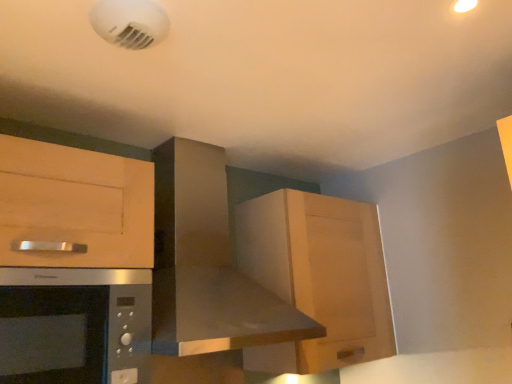
You are a GUI agent. You are given a task and a screenshot of the screen. Output one action in this format:
    pyautogui.click(x=<x>, y=<y>)
    Task: Click on the stainless steel range hood at center
    
    Given the screenshot: What is the action you would take?
    pyautogui.click(x=206, y=264)

Which object is positioned more to the left, satin silver microwave at lower left or stainless steel range hood at center?

satin silver microwave at lower left is more to the left.

Based on their sizes in the image, would you say satin silver microwave at lower left is bigger or smaller than stainless steel range hood at center?

satin silver microwave at lower left is smaller than stainless steel range hood at center.

Is satin silver microwave at lower left taller or shorter than stainless steel range hood at center?

Clearly, satin silver microwave at lower left is shorter compared to stainless steel range hood at center.

Would you consider satin silver microwave at lower left to be distant from wooden cabinet at upper right?

No, satin silver microwave at lower left is not far from wooden cabinet at upper right.

In the scene shown: From a real-world perspective, who is located higher, satin silver microwave at lower left or wooden cabinet at upper right?

In real-world perspective, wooden cabinet at upper right is above.

Which object is further away from the camera taking this photo, satin silver microwave at lower left or wooden cabinet at upper right?

wooden cabinet at upper right is more distant.

Is stainless steel range hood at center spatially inside wooden cabinet at upper right, or outside of it?

stainless steel range hood at center lies outside wooden cabinet at upper right.

Does stainless steel range hood at center turn towards wooden cabinet at upper right?

No, stainless steel range hood at center is not turned towards wooden cabinet at upper right.

Considering the relative sizes of stainless steel range hood at center and wooden cabinet at upper right in the image provided, is stainless steel range hood at center smaller than wooden cabinet at upper right?

No, stainless steel range hood at center is not smaller than wooden cabinet at upper right.

Is wooden cabinet at upper right in front of or behind stainless steel range hood at center in the image?

wooden cabinet at upper right is behind stainless steel range hood at center.

Is wooden cabinet at upper right inside the boundaries of stainless steel range hood at center, or outside?

wooden cabinet at upper right cannot be found inside stainless steel range hood at center.

Consider the image. From a real-world perspective, which is physically above, wooden cabinet at upper right or stainless steel range hood at center?

stainless steel range hood at center.

Looking at this image, which of these two, wooden cabinet at upper right or stainless steel range hood at center, is smaller?

wooden cabinet at upper right is smaller.

Would you say stainless steel range hood at center contains satin silver microwave at lower left?

No.

From the image's perspective, which is below, stainless steel range hood at center or satin silver microwave at lower left?

satin silver microwave at lower left.

Is stainless steel range hood at center aimed at satin silver microwave at lower left?

No, stainless steel range hood at center does not turn towards satin silver microwave at lower left.

From a real-world perspective, between wooden cabinet at upper right and satin silver microwave at lower left, who is vertically lower?

satin silver microwave at lower left is physically lower.

Which of these two, wooden cabinet at upper right or satin silver microwave at lower left, is thinner?

Thinner between the two is satin silver microwave at lower left.

Relative to satin silver microwave at lower left, is wooden cabinet at upper right in front or behind?

In the image, wooden cabinet at upper right appears behind satin silver microwave at lower left.

The width and height of the screenshot is (512, 384). In the image, there is a stainless steel range hood at center. In order to click on microwave oven below it (from a real-world perspective) in this screenshot , I will do `click(74, 325)`.

At what (x,y) coordinates should I click in order to perform the action: click on cabinetry above the satin silver microwave at lower left (from a real-world perspective). Please return your answer as a coordinate pair (x, y). This screenshot has height=384, width=512. Looking at the image, I should click on (318, 277).

Considering their positions, is wooden cabinet at upper right positioned closer to satin silver microwave at lower left than stainless steel range hood at center?

stainless steel range hood at center is closer to satin silver microwave at lower left.

Based on their spatial positions, is wooden cabinet at upper right or satin silver microwave at lower left closer to stainless steel range hood at center?

wooden cabinet at upper right is positioned closer to the anchor stainless steel range hood at center.

Looking at the image, which one is located closer to wooden cabinet at upper right, stainless steel range hood at center or satin silver microwave at lower left?

Based on the image, stainless steel range hood at center appears to be nearer to wooden cabinet at upper right.

Estimate the real-world distances between objects in this image. Which object is closer to satin silver microwave at lower left, stainless steel range hood at center or wooden cabinet at upper right?

Among the two, stainless steel range hood at center is located nearer to satin silver microwave at lower left.

When comparing their distances from stainless steel range hood at center, does satin silver microwave at lower left or wooden cabinet at upper right seem closer?

The object closer to stainless steel range hood at center is wooden cabinet at upper right.

Looking at the image, which one is located further to wooden cabinet at upper right, satin silver microwave at lower left or stainless steel range hood at center?

satin silver microwave at lower left is positioned further to the anchor wooden cabinet at upper right.

I want to click on home appliance between satin silver microwave at lower left and wooden cabinet at upper right, so [206, 264].